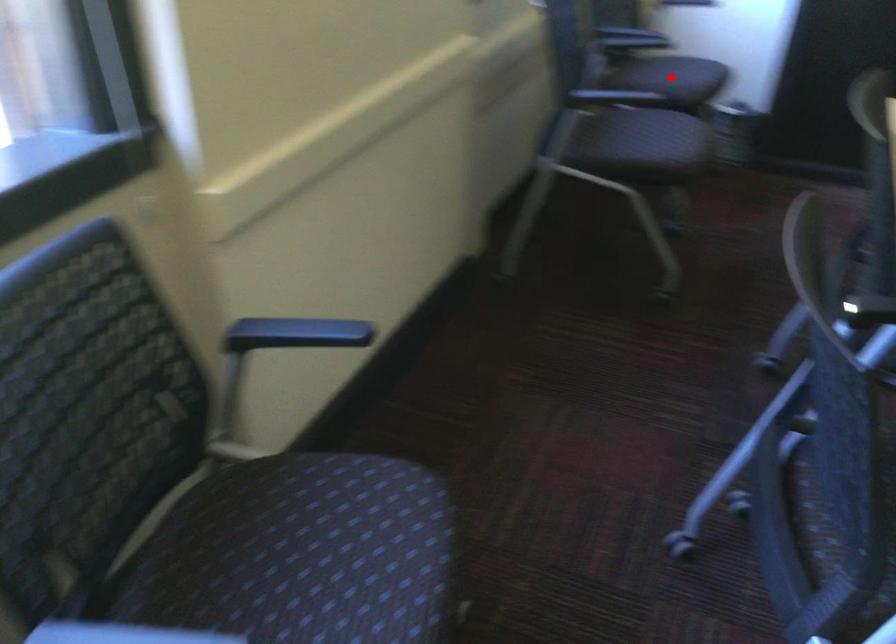
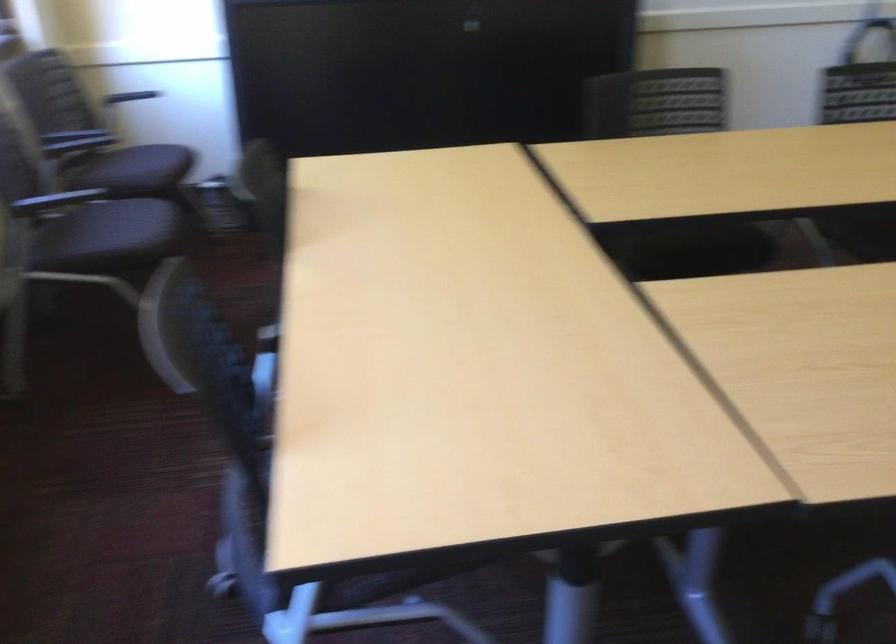
The point at the highlighted location is marked in the first image. Where is the corresponding point in the second image?

(135, 169)